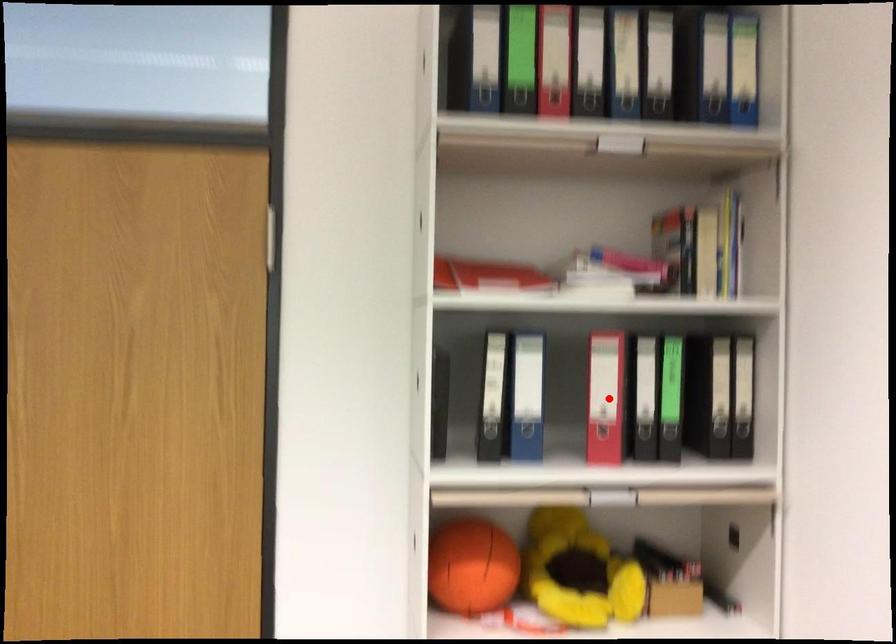
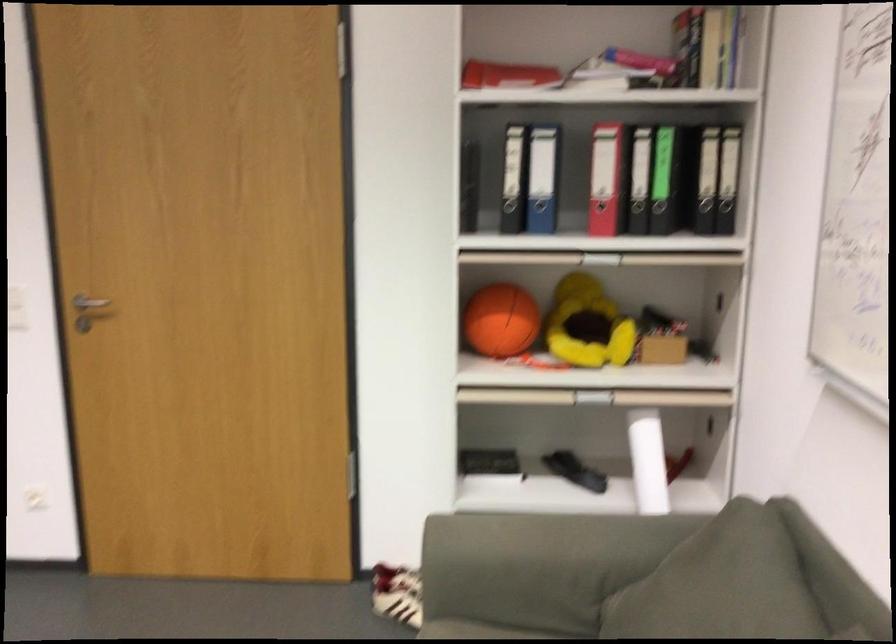
Where in the second image is the point corresponding to the highlighted location from the first image?

(606, 178)